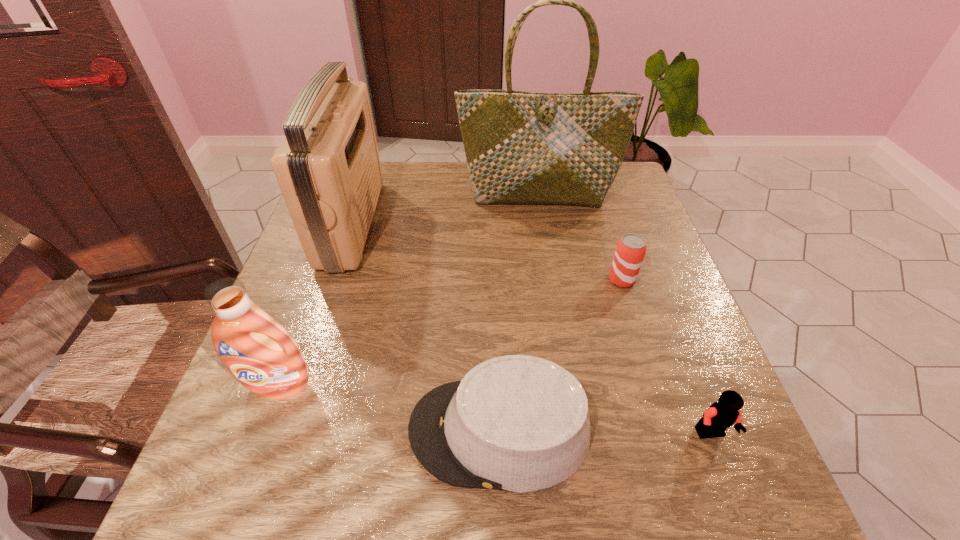
Locate an element on the screen. free space in the image that satisfies the following two spatial constraints: 1. on the front side of the shopping bag; 2. on the front-facing side of the hat is located at coordinates (575, 430).

Locate an element on the screen. The width and height of the screenshot is (960, 540). free space that satisfies the following two spatial constraints: 1. on the front side of the beer can; 2. on the left side of the shopping bag is located at coordinates click(x=551, y=280).

At what (x,y) coordinates should I click in order to perform the action: click on vacant space that satisfies the following two spatial constraints: 1. on the front-facing side of the radio receiver; 2. on the front-facing side of the detergent. Please return your answer as a coordinate pair (x, y). This screenshot has width=960, height=540. Looking at the image, I should click on (298, 386).